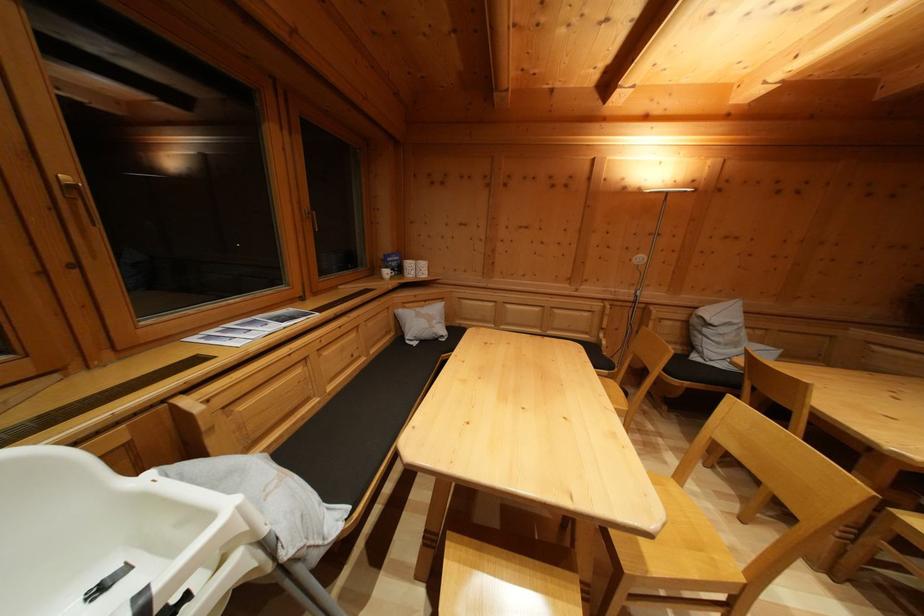
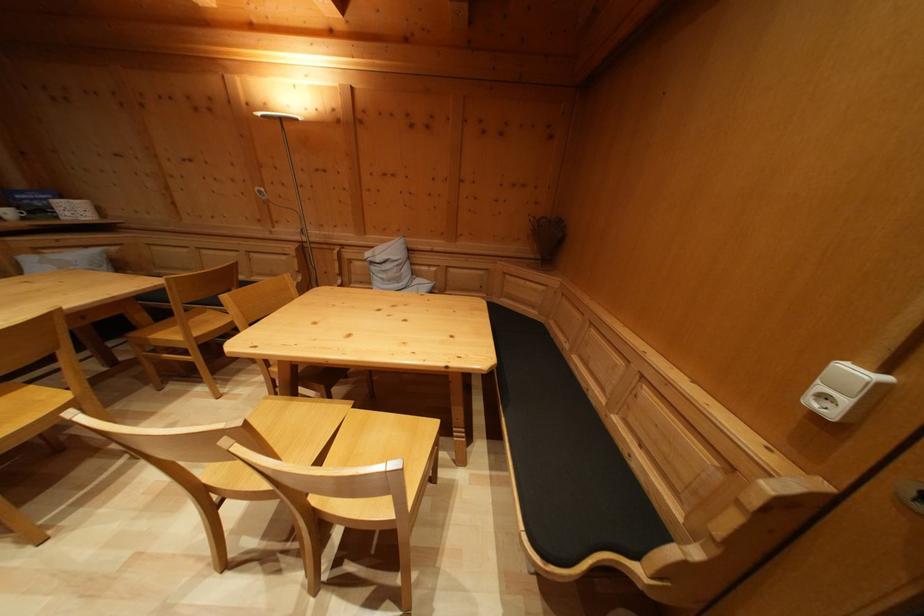
Question: Which direction would the cameraman need to move to produce the second image? Reply with the corresponding letter.

Choices:
 (A) Left
 (B) Right
 (C) Forward
 (D) Backward

Answer: (B)